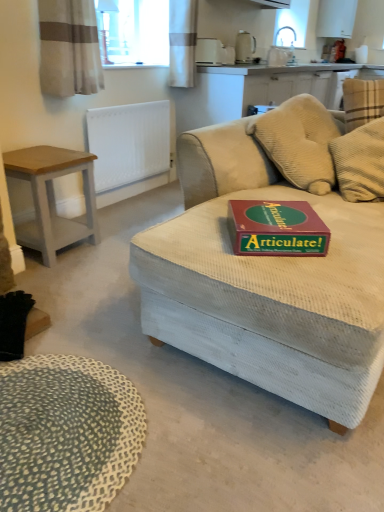
Question: Are textured beige mat at lower left and white textured curtain at upper center, the 1th curtain in the back-to-front sequence, making contact?

Choices:
 (A) yes
 (B) no

Answer: (B)

Question: Considering the relative sizes of textured beige mat at lower left and white textured curtain at upper center, arranged as the second curtain when viewed from the left, in the image provided, is textured beige mat at lower left wider than white textured curtain at upper center, arranged as the second curtain when viewed from the left,?

Choices:
 (A) yes
 (B) no

Answer: (A)

Question: Is textured beige mat at lower left bigger than white textured curtain at upper center, which ranks as the 2th curtain in front-to-back order?

Choices:
 (A) no
 (B) yes

Answer: (A)

Question: Does textured beige mat at lower left appear on the left side of white textured curtain at upper center, which ranks as the 2th curtain in front-to-back order?

Choices:
 (A) yes
 (B) no

Answer: (A)

Question: Considering the relative sizes of textured beige mat at lower left and white textured curtain at upper center, which is counted as the 1th curtain, starting from the right, in the image provided, is textured beige mat at lower left shorter than white textured curtain at upper center, which is counted as the 1th curtain, starting from the right,?

Choices:
 (A) no
 (B) yes

Answer: (B)

Question: Are textured beige mat at lower left and white textured curtain at upper center, arranged as the second curtain when viewed from the left, located far from each other?

Choices:
 (A) no
 (B) yes

Answer: (B)

Question: Is white textured radiator at upper left facing towards textured beige mat at lower left?

Choices:
 (A) yes
 (B) no

Answer: (B)

Question: Does white textured radiator at upper left have a lesser width compared to textured beige mat at lower left?

Choices:
 (A) no
 (B) yes

Answer: (B)

Question: From a real-world perspective, is white textured radiator at upper left physically below textured beige mat at lower left?

Choices:
 (A) no
 (B) yes

Answer: (A)

Question: Considering the relative sizes of white textured radiator at upper left and textured beige mat at lower left in the image provided, is white textured radiator at upper left taller than textured beige mat at lower left?

Choices:
 (A) yes
 (B) no

Answer: (A)

Question: Is white textured radiator at upper left closer to camera compared to textured beige mat at lower left?

Choices:
 (A) yes
 (B) no

Answer: (B)

Question: From the image's perspective, is white textured radiator at upper left above textured beige mat at lower left?

Choices:
 (A) no
 (B) yes

Answer: (B)

Question: Is white textured curtain at upper center, which ranks as the 2th curtain in front-to-back order, further to camera compared to matte beige kettle at upper center, which is the second appliance in bottom-to-top order?

Choices:
 (A) no
 (B) yes

Answer: (A)